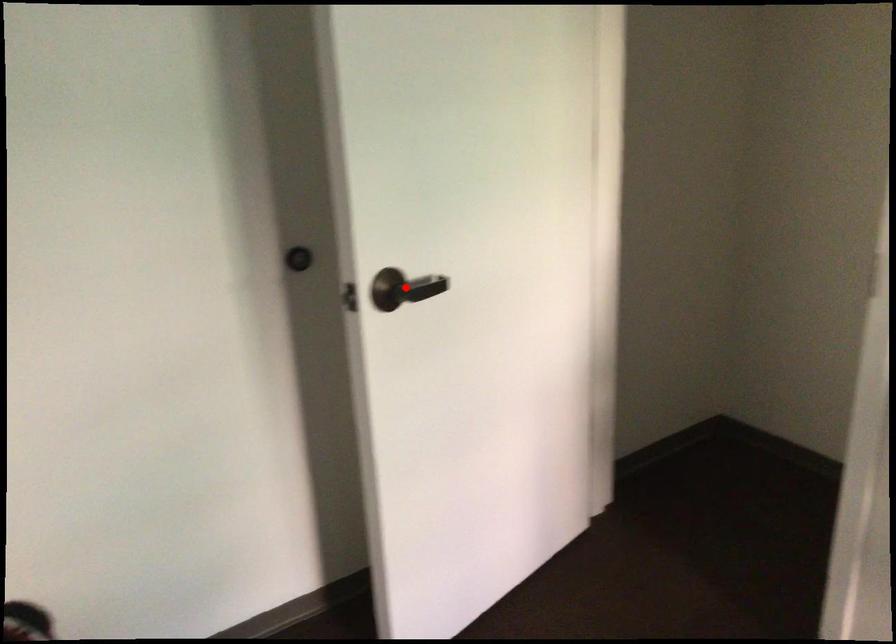
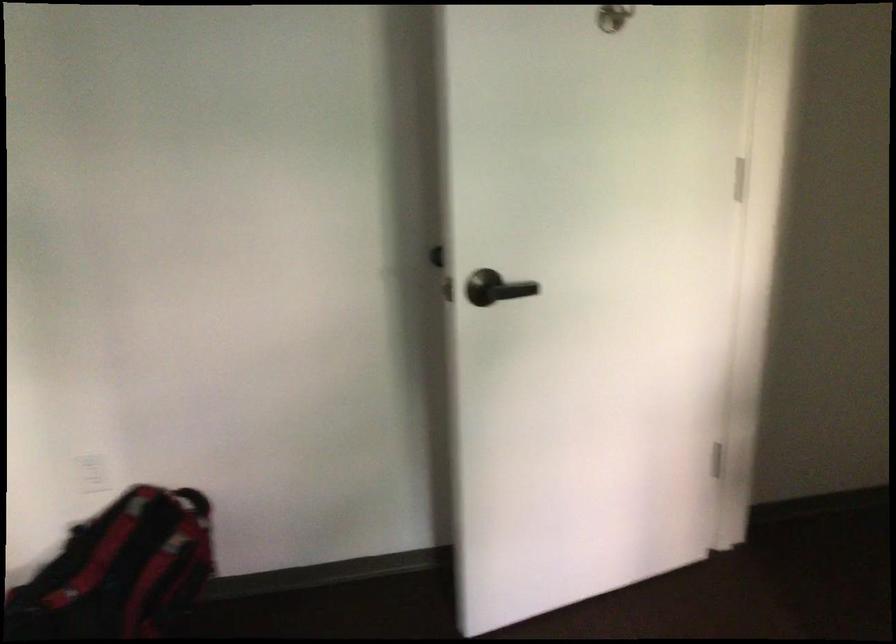
Question: I am providing you with two images of the same scene from different viewpoints. A red point is shown in image1. For the corresponding object point in image2, is it positioned nearer or farther from the camera?

Choices:
 (A) Nearer
 (B) Farther

Answer: (B)